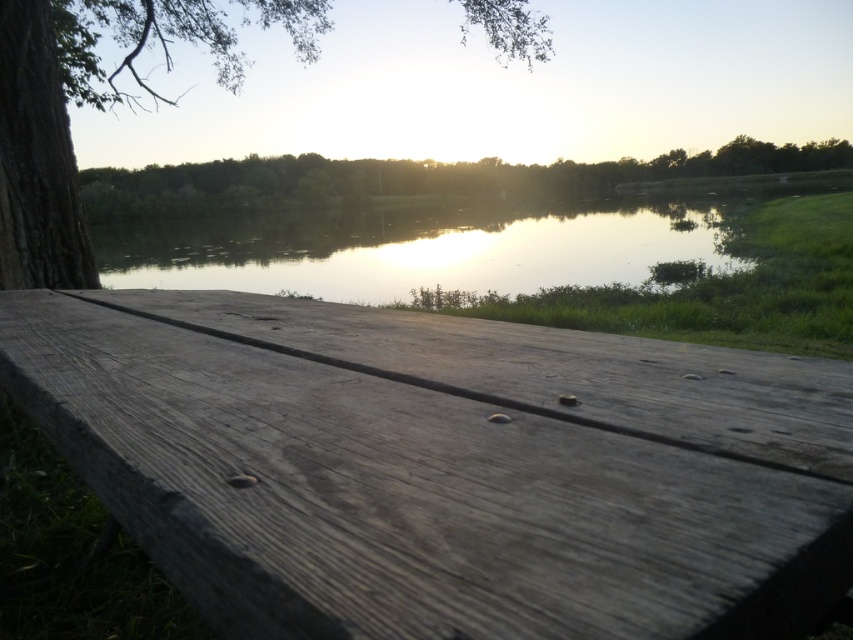
Question: Which point is farther to the camera?

Choices:
 (A) smooth brown tree trunk at left
 (B) glistening water at center
 (C) green leafy tree at upper center
 (D) weathered wood picnic table at center

Answer: (B)

Question: Is weathered wood picnic table at center to the left of glistening water at center from the viewer's perspective?

Choices:
 (A) no
 (B) yes

Answer: (B)

Question: Is weathered wood picnic table at center to the left of green leafy tree at upper center from the viewer's perspective?

Choices:
 (A) yes
 (B) no

Answer: (A)

Question: Does weathered wood picnic table at center appear over smooth brown tree trunk at left?

Choices:
 (A) no
 (B) yes

Answer: (A)

Question: Which point is closer to the camera?

Choices:
 (A) green leafy tree at upper center
 (B) smooth brown tree trunk at left
 (C) glistening water at center

Answer: (B)

Question: Which point is closer to the camera taking this photo?

Choices:
 (A) coord(708,381)
 (B) coord(83,58)

Answer: (A)